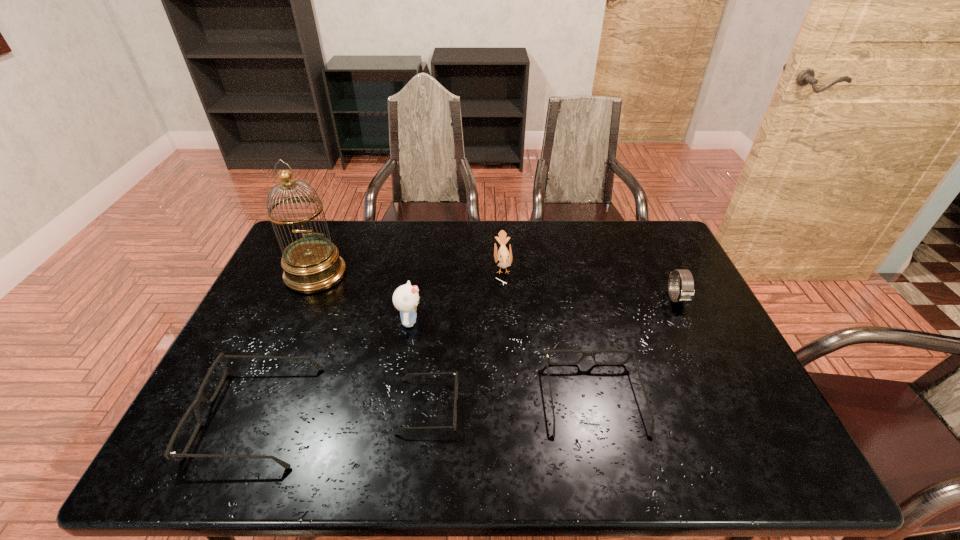
At what (x,y) coordinates should I click in order to perform the action: click on vacant space at the right edge of the desktop. Please return your answer as a coordinate pair (x, y). Looking at the image, I should click on (730, 359).

Identify the location of vacant space at the far left corner of the desktop. (322, 223).

Identify the location of free space at the far right corner of the desktop. The height and width of the screenshot is (540, 960). (644, 255).

At what (x,y) coordinates should I click in order to perform the action: click on vacant area between the fifth object from left to right and the second tallest object. Please return your answer as a coordinate pair (x, y). Looking at the image, I should click on (456, 294).

Where is `empty location between the sixth object from left to right and the second spectacles from left to right`? empty location between the sixth object from left to right and the second spectacles from left to right is located at coordinates click(x=511, y=402).

This screenshot has width=960, height=540. I want to click on free spot between the rightmost spectacles and the rightmost object, so click(636, 348).

Locate an element on the screen. free space between the tallest object and the leftmost spectacles is located at coordinates (286, 345).

Identify the location of vacant space that is in between the watch and the fifth object from left to right. (589, 282).

The width and height of the screenshot is (960, 540). What are the coordinates of `vacant area between the kitten and the rightmost spectacles` in the screenshot? It's located at (502, 360).

Identify the location of free point between the watch and the third object from right to left. The image size is (960, 540). (589, 282).